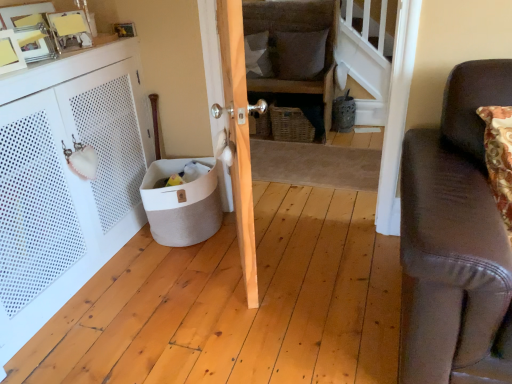
Question: Should I look upward or downward to see white perforated cabinet at left?

Choices:
 (A) up
 (B) down

Answer: (A)

Question: Should I look upward or downward to see wooden door at center?

Choices:
 (A) up
 (B) down

Answer: (A)

Question: Is white fabric pillow at center, the 2th pillow viewed from the left, positioned far away from beige fabric basket at lower left?

Choices:
 (A) no
 (B) yes

Answer: (B)

Question: Does white fabric pillow at center, the 2th pillow viewed from the left, have a greater height compared to beige fabric basket at lower left?

Choices:
 (A) no
 (B) yes

Answer: (B)

Question: Is white fabric pillow at center, which is counted as the 1th pillow, starting from the right, smaller than beige fabric basket at lower left?

Choices:
 (A) no
 (B) yes

Answer: (B)

Question: From a real-world perspective, is white fabric pillow at center, the 2th pillow viewed from the left, beneath beige fabric basket at lower left?

Choices:
 (A) no
 (B) yes

Answer: (A)

Question: From the image's perspective, would you say white fabric pillow at center, the 2th pillow viewed from the left, is positioned over beige fabric basket at lower left?

Choices:
 (A) no
 (B) yes

Answer: (B)

Question: Is white fabric pillow at center, the 2th pillow viewed from the left, closer to the viewer compared to beige fabric basket at lower left?

Choices:
 (A) no
 (B) yes

Answer: (A)

Question: Does woven wicker basket at center have a smaller size compared to textured gray pillow at upper center, marked as the 2th pillow in a right-to-left arrangement?

Choices:
 (A) no
 (B) yes

Answer: (A)

Question: From a real-world perspective, is woven wicker basket at center on top of textured gray pillow at upper center, which appears as the 1th pillow when viewed from the left?

Choices:
 (A) no
 (B) yes

Answer: (A)

Question: Would you say woven wicker basket at center contains textured gray pillow at upper center, which appears as the 1th pillow when viewed from the left?

Choices:
 (A) yes
 (B) no

Answer: (A)

Question: Is woven wicker basket at center facing towards textured gray pillow at upper center, which appears as the 1th pillow when viewed from the left?

Choices:
 (A) yes
 (B) no

Answer: (A)

Question: Is the depth of woven wicker basket at center less than that of textured gray pillow at upper center, which appears as the 1th pillow when viewed from the left?

Choices:
 (A) yes
 (B) no

Answer: (A)

Question: Does woven wicker basket at center have a greater height compared to textured gray pillow at upper center, which appears as the 1th pillow when viewed from the left?

Choices:
 (A) no
 (B) yes

Answer: (B)

Question: Does woven brown basket at center have a larger size compared to white fabric pillow at center, which is counted as the 1th pillow, starting from the right?

Choices:
 (A) no
 (B) yes

Answer: (B)